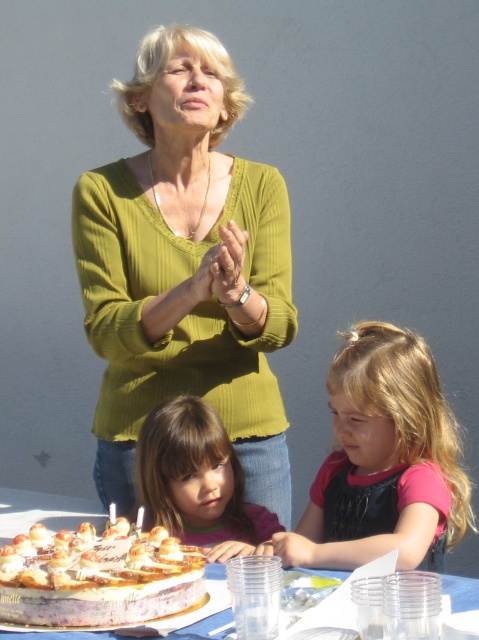
You are a photographer trying to capture a closeup of the cake. You need to position yourself between the green ribbed sweater at center and the matte pink shirt at lower center. Which direction should you move to ensure you are between them without blocking either?

Move towards the matte pink shirt at lower center, as the green ribbed sweater at center is wider than the matte pink shirt at lower center, so positioning yourself closer to the narrower matte pink shirt at lower center will keep you between both while avoiding obstruction.